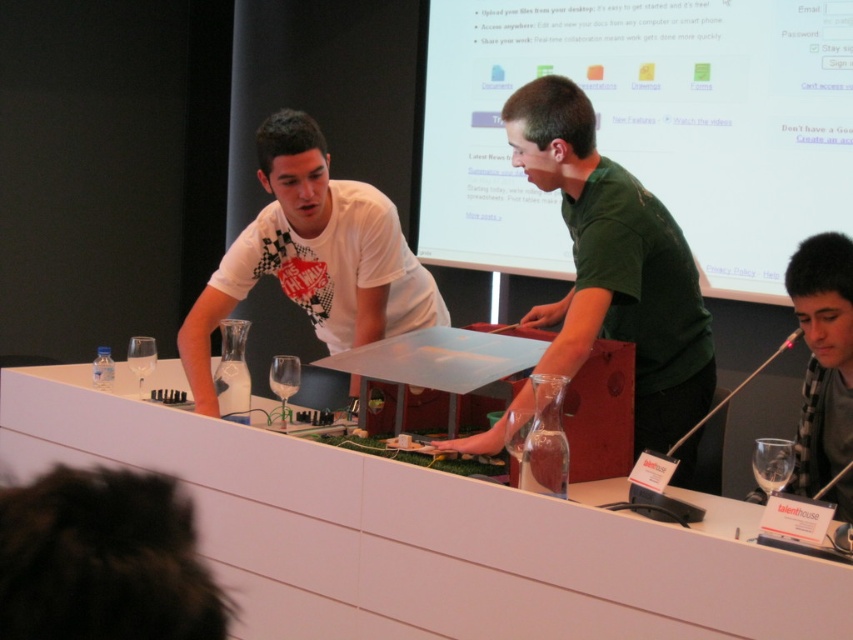
Question: Can you confirm if white glossy projection screen at upper center is smaller than green grassy mat at center?

Choices:
 (A) yes
 (B) no

Answer: (B)

Question: Which point is farther from the camera taking this photo?

Choices:
 (A) (842, 429)
 (B) (285, 376)

Answer: (B)

Question: Which point is closer to the camera?

Choices:
 (A) white glossy table at center
 (B) transparent glass at lower right
 (C) green grassy mat at center
 (D) white glossy projection screen at upper center

Answer: (A)

Question: Based on their relative distances, which object is farther from the green matte shirt at center?

Choices:
 (A) white glossy projection screen at upper center
 (B) gray checkered scarf at lower right
 (C) green grassy mat at center
 (D) transparent glass wine glass at center

Answer: (A)

Question: Is white glossy projection screen at upper center bigger than white matte shirt at center?

Choices:
 (A) yes
 (B) no

Answer: (A)

Question: Can you confirm if white glossy projection screen at upper center is thinner than transparent glass at lower right?

Choices:
 (A) yes
 (B) no

Answer: (B)